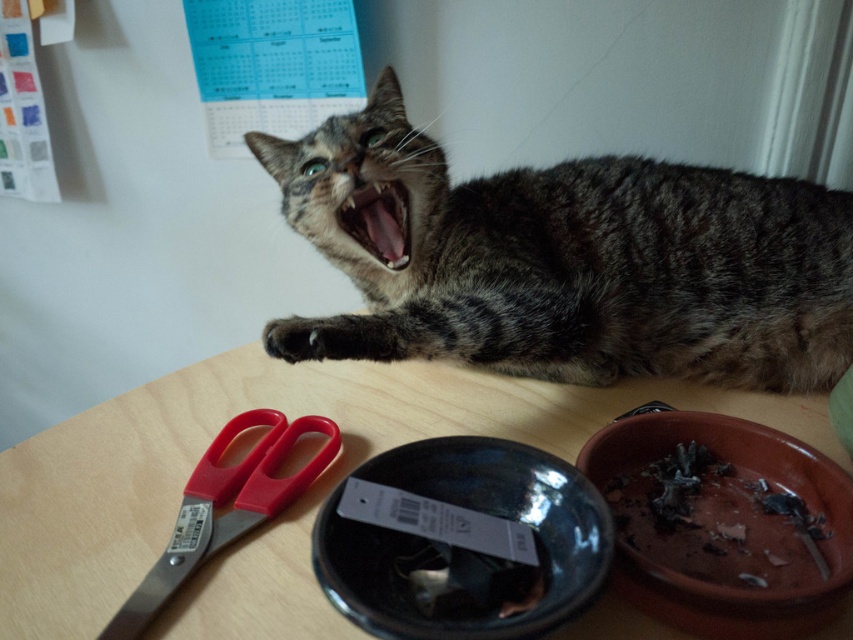
You are a cat owner who wants to place a new toy between the glossy ceramic bowl at lower center and the red plastic scissors at lower left. The toy is 4 inches long. Will there be enough space between them to fit the toy?

The glossy ceramic bowl at lower center and the red plastic scissors at lower left are 8.06 inches apart from each other. Since the toy is only 4 inches long, it will fit comfortably between them with space to spare.

You are a cat owner who wants to ensure your cat doesn not accidentally swallow the scissors. Given the distance between the glossy ceramic bowl at lower center and the smooth white teeth at center, can you estimate if the cat is close enough to reach the scissors?

The glossy ceramic bowl at lower center is 15.33 inches from the smooth white teeth at center. Since the scissors are to the left of the bowl, the distance from the cat to the scissors would be greater than 15.33 inches. Therefore, the cat may not be close enough to reach the scissors.